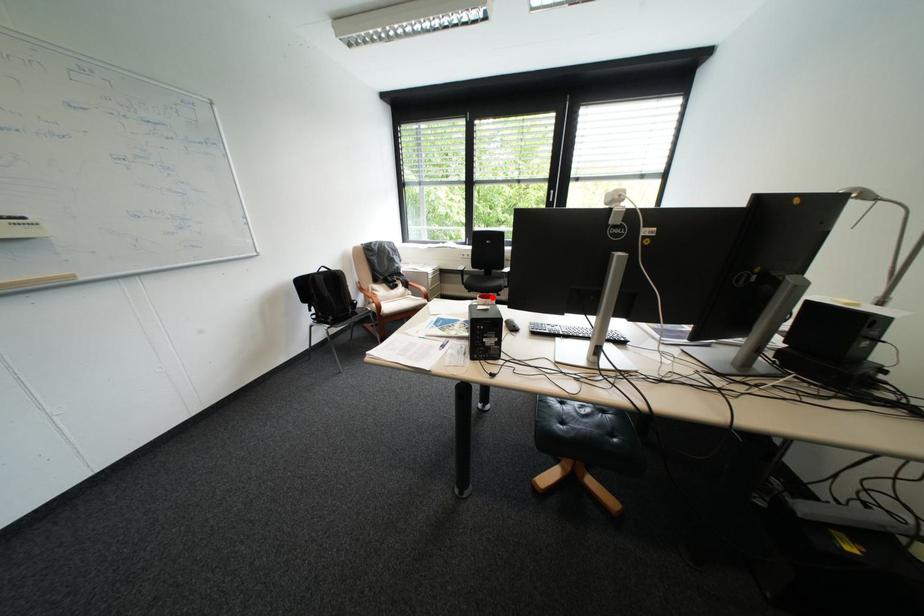
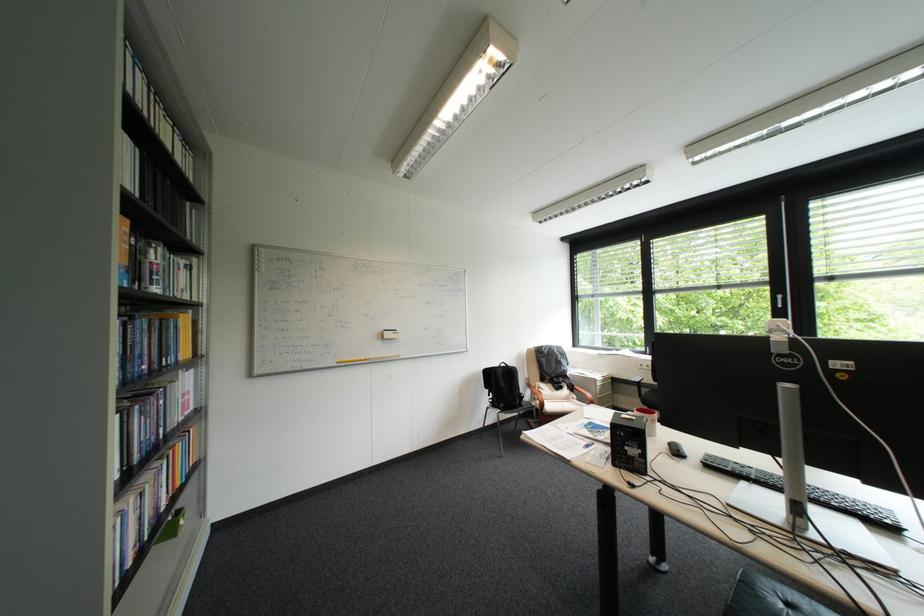
Locate, in the second image, the point that corresponds to the highlighted location in the first image.

(650, 411)